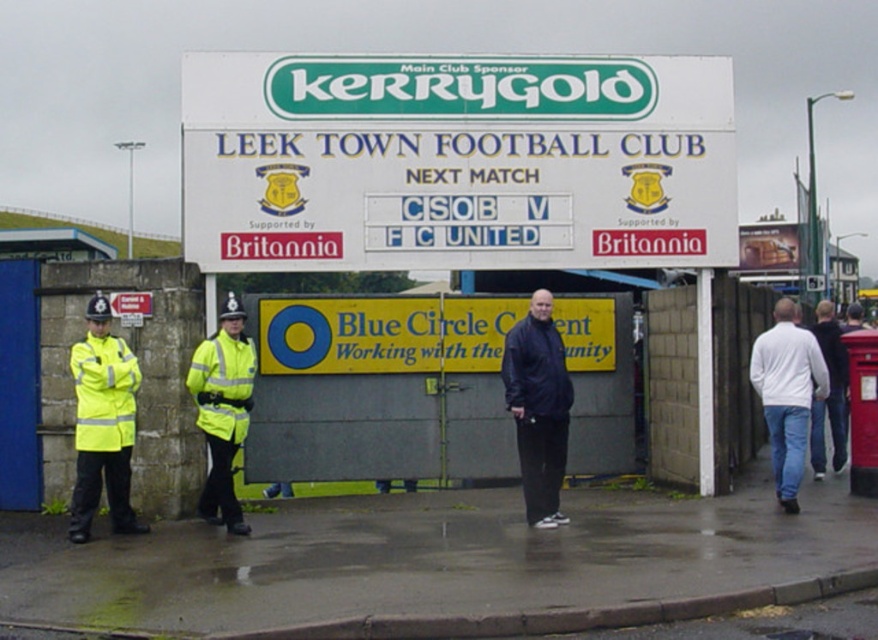
Does green plastic sign at upper center have a lesser height compared to high-visibility fabric safety vest at left?

Yes.

What do you see at coordinates (457, 161) in the screenshot? I see `green plastic sign at upper center` at bounding box center [457, 161].

Is point (193, 196) positioned before point (90, 307)?

That is False.

Where is `green plastic sign at upper center`? green plastic sign at upper center is located at coordinates (457, 161).

Based on the photo, is green plastic sign at upper center in front of white matte shirt at center?

No.

Can you confirm if green plastic sign at upper center is shorter than white matte shirt at center?

No.

What do you see at coordinates (457, 161) in the screenshot? The width and height of the screenshot is (878, 640). I see `green plastic sign at upper center` at bounding box center [457, 161].

What are the coordinates of `green plastic sign at upper center` in the screenshot? It's located at (457, 161).

Can you confirm if black matte jacket at center is wider than white matte shirt at center?

No.

Can you confirm if black matte jacket at center is smaller than white matte shirt at center?

Indeed, black matte jacket at center has a smaller size compared to white matte shirt at center.

Which is in front, point (507, 385) or point (786, 484)?

Point (507, 385)

Where is `black matte jacket at center`? The image size is (878, 640). black matte jacket at center is located at coordinates (538, 406).